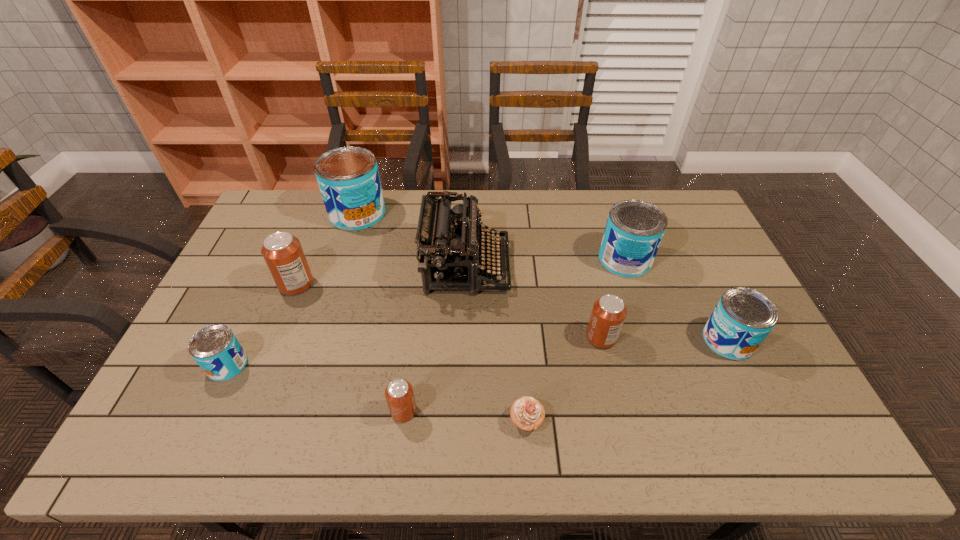
You are a GUI agent. You are given a task and a screenshot of the screen. Output one action in this format:
    pyautogui.click(x=<x>, y=<y>)
    Task: Click on the farthest object
    Image resolution: width=960 pixels, height=540 pixels.
    Given the screenshot: What is the action you would take?
    pyautogui.click(x=348, y=178)

Where is `the farthest can`? This screenshot has height=540, width=960. the farthest can is located at coordinates (348, 178).

Where is `typewriter`? Image resolution: width=960 pixels, height=540 pixels. typewriter is located at coordinates (449, 251).

Where is `the third smallest blue can`? the third smallest blue can is located at coordinates (634, 230).

Where is `the second farthest blue can`? The height and width of the screenshot is (540, 960). the second farthest blue can is located at coordinates (634, 230).

At what (x,y) coordinates should I click in order to perform the action: click on the farthest orange can. Please return your answer as a coordinate pair (x, y). Looking at the image, I should click on (282, 252).

Where is `the leftmost orange can`? This screenshot has width=960, height=540. the leftmost orange can is located at coordinates (282, 252).

Image resolution: width=960 pixels, height=540 pixels. Find the location of `the rightmost orange can`. the rightmost orange can is located at coordinates (608, 314).

The height and width of the screenshot is (540, 960). Find the location of `the third object from right to left`. the third object from right to left is located at coordinates tap(608, 314).

This screenshot has width=960, height=540. In order to click on the rightmost can in this screenshot , I will do `click(743, 318)`.